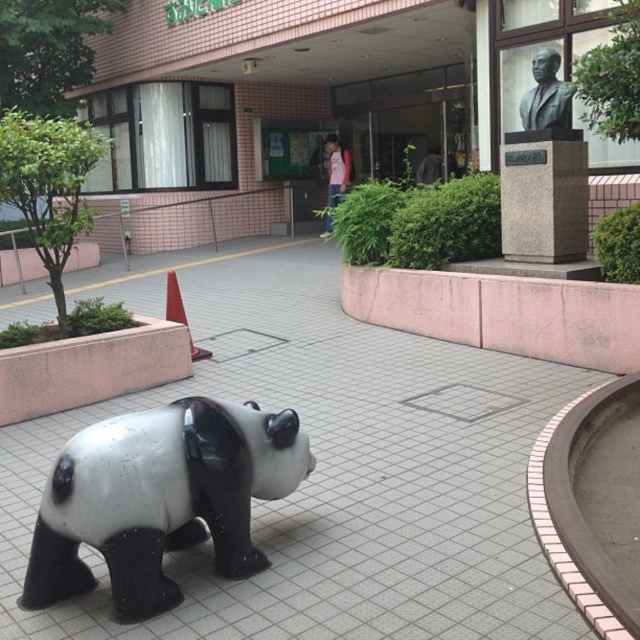
Question: Which point is closer to the camera?

Choices:
 (A) (540, 51)
 (B) (387, 488)
 (C) (204, 348)

Answer: (B)

Question: Considering the real-world distances, which object is farthest from the black and white glossy panda at center?

Choices:
 (A) orange plastic traffic cone at lower left
 (B) bronze bust at upper right

Answer: (B)

Question: Can you confirm if white glossy pavement at center is positioned above orange plastic traffic cone at lower left?

Choices:
 (A) no
 (B) yes

Answer: (A)

Question: Can you confirm if black and white glossy panda at center is bigger than bronze bust at upper right?

Choices:
 (A) yes
 (B) no

Answer: (A)

Question: Is black and white glossy panda at center thinner than bronze bust at upper right?

Choices:
 (A) no
 (B) yes

Answer: (A)

Question: Among these points, which one is nearest to the camera?

Choices:
 (A) (540, 88)
 (B) (193, 296)

Answer: (A)